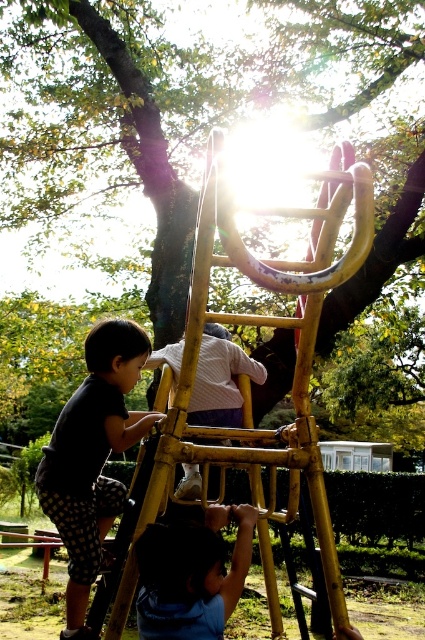
Based on the photo, is green leafy tree at upper center closer to camera compared to blue fabric pants at lower center?

No, it is not.

Does point (271, 348) lie behind point (158, 621)?

Yes, point (271, 348) is behind point (158, 621).

This screenshot has height=640, width=425. Identify the location of green leafy tree at upper center. (167, 104).

Does green leafy tree at upper center have a greater height compared to dark gray shirt at left?

Yes, green leafy tree at upper center is taller than dark gray shirt at left.

Who is taller, green leafy tree at upper center or dark gray shirt at left?

green leafy tree at upper center is taller.

Is point (141, 65) closer to viewer compared to point (82, 605)?

No, (141, 65) is behind (82, 605).

Locate an element on the screen. green leafy tree at upper center is located at coordinates click(167, 104).

Who is lower down, gold metallic ladder at center or yellow wood ladder at center?

yellow wood ladder at center is lower down.

Who is more forward, (309, 276) or (197, 416)?

Point (309, 276) is more forward.

Does point (357, 244) come closer to viewer compared to point (232, 392)?

That is True.

The width and height of the screenshot is (425, 640). Find the location of `gold metallic ladder at center`. gold metallic ladder at center is located at coordinates (x=266, y=324).